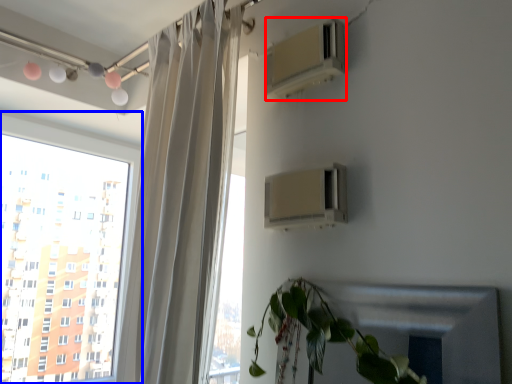
Question: Among these objects, which one is nearest to the camera, air conditioning (highlighted by a red box) or window (highlighted by a blue box)?

Choices:
 (A) air conditioning
 (B) window

Answer: (A)